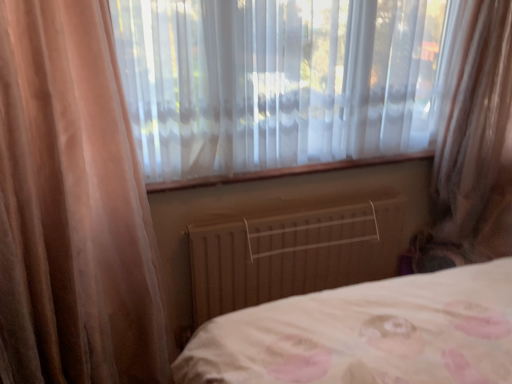
Question: Considering the relative sizes of translucent fabric at center and translucent fabric curtain at right in the image provided, is translucent fabric at center smaller than translucent fabric curtain at right?

Choices:
 (A) no
 (B) yes

Answer: (B)

Question: Considering the relative positions of translucent fabric at center and translucent fabric curtain at right in the image provided, is translucent fabric at center to the left of translucent fabric curtain at right from the viewer's perspective?

Choices:
 (A) yes
 (B) no

Answer: (A)

Question: From the image's perspective, is translucent fabric at center under translucent fabric curtain at right?

Choices:
 (A) yes
 (B) no

Answer: (B)

Question: Is translucent fabric at center touching translucent fabric curtain at right?

Choices:
 (A) yes
 (B) no

Answer: (B)

Question: Considering the relative sizes of translucent fabric at center and translucent fabric curtain at right in the image provided, is translucent fabric at center thinner than translucent fabric curtain at right?

Choices:
 (A) no
 (B) yes

Answer: (B)

Question: Is translucent fabric curtain at right completely or partially inside translucent fabric at center?

Choices:
 (A) no
 (B) yes

Answer: (A)

Question: Is wooden radiator at center next to translucent fabric at center?

Choices:
 (A) yes
 (B) no

Answer: (B)

Question: From a real-world perspective, is wooden radiator at center beneath translucent fabric at center?

Choices:
 (A) yes
 (B) no

Answer: (A)

Question: Can we say wooden radiator at center lies outside translucent fabric at center?

Choices:
 (A) no
 (B) yes

Answer: (B)

Question: Is wooden radiator at center facing away from translucent fabric at center?

Choices:
 (A) no
 (B) yes

Answer: (A)

Question: Does wooden radiator at center have a lesser width compared to translucent fabric at center?

Choices:
 (A) no
 (B) yes

Answer: (B)

Question: Can you confirm if wooden radiator at center is bigger than translucent fabric at center?

Choices:
 (A) no
 (B) yes

Answer: (A)

Question: Can wooden radiator at center be found inside translucent fabric curtain at right?

Choices:
 (A) no
 (B) yes

Answer: (A)